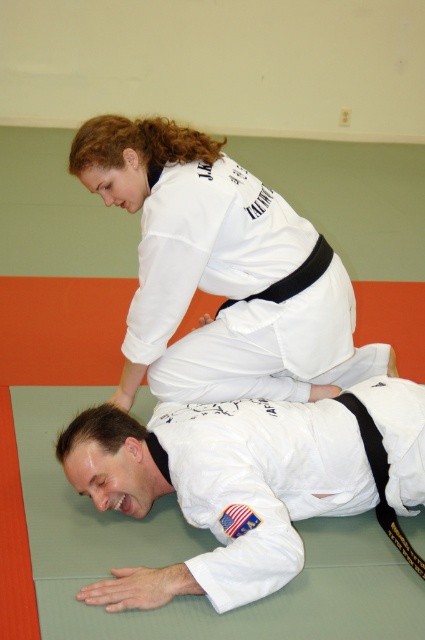
Question: Can you confirm if white matte kimono at upper center is positioned to the left of black matte belt at center?

Choices:
 (A) no
 (B) yes

Answer: (B)

Question: Which of the following is the closest to the observer?

Choices:
 (A) (226, 164)
 (B) (311, 276)
 (C) (192, 500)

Answer: (C)

Question: Which point appears farthest from the camera in this image?

Choices:
 (A) (294, 365)
 (B) (295, 285)

Answer: (A)

Question: Is the position of white matte kimono at upper center more distant than that of black matte belt at center?

Choices:
 (A) yes
 (B) no

Answer: (B)

Question: Which point appears closest to the camera in this image?

Choices:
 (A) (90, 132)
 (B) (371, 481)
 (C) (280, 298)

Answer: (B)

Question: Where is white matte kimono at upper center located in relation to black matte belt at center in the image?

Choices:
 (A) right
 (B) left

Answer: (B)